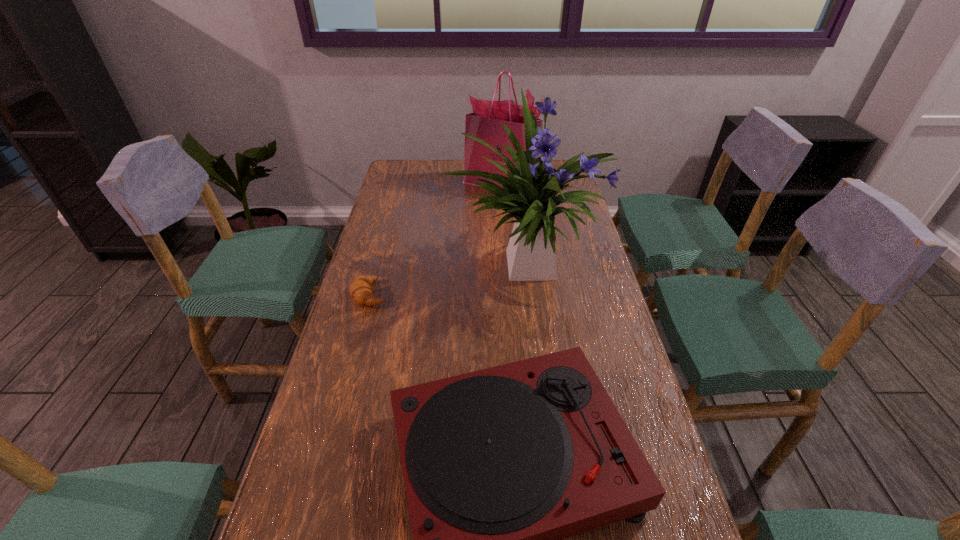
This screenshot has height=540, width=960. In order to click on flower arrangement that is at the right edge in this screenshot , I will do pyautogui.click(x=529, y=194).

Identify the location of shopping bag present at the right edge. This screenshot has width=960, height=540. (485, 123).

At what (x,y) coordinates should I click in order to perform the action: click on object that is at the far right corner. Please return your answer as a coordinate pair (x, y). This screenshot has height=540, width=960. Looking at the image, I should click on (485, 123).

In the image, there is a desktop. What are the coordinates of `vacant space at the far edge` in the screenshot? It's located at pyautogui.click(x=464, y=178).

The height and width of the screenshot is (540, 960). I want to click on vacant space at the left edge of the desktop, so point(406,205).

Image resolution: width=960 pixels, height=540 pixels. I want to click on vacant area at the right edge of the desktop, so click(600, 322).

Locate an element on the screen. The image size is (960, 540). free space between the third shortest object and the crescent roll is located at coordinates (436, 239).

At what (x,y) coordinates should I click in order to perform the action: click on free space between the flower arrangement and the farthest object. Please return your answer as a coordinate pair (x, y). This screenshot has height=540, width=960. Looking at the image, I should click on (514, 224).

Locate an element on the screen. empty location between the shopping bag and the shortest object is located at coordinates point(436,239).

You are a GUI agent. You are given a task and a screenshot of the screen. Output one action in this format:
    pyautogui.click(x=<x>, y=<y>)
    Task: Click on the blank region between the shopping bag and the flower arrangement
    
    Given the screenshot: What is the action you would take?
    pyautogui.click(x=514, y=224)